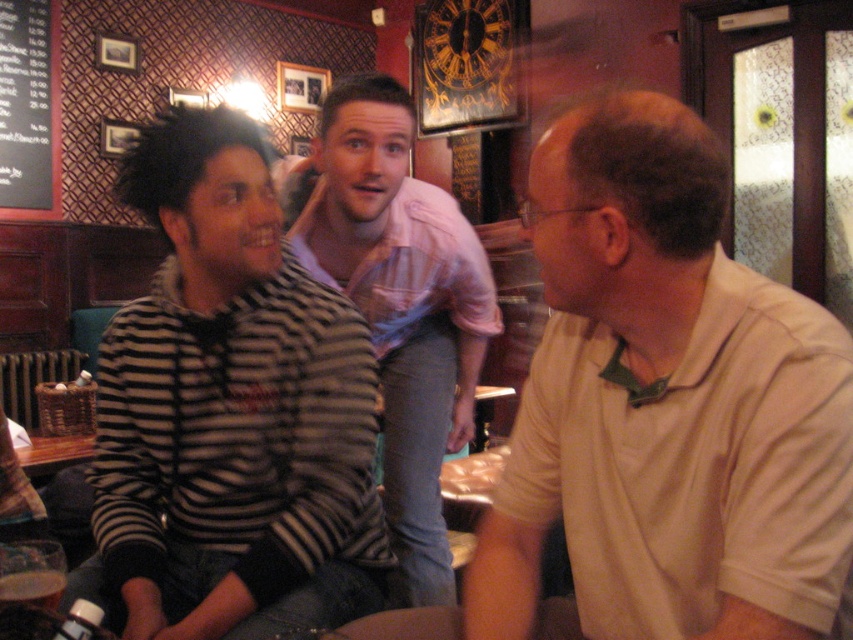
Is point (834, 616) farther from viewer compared to point (238, 122)?

No, it is in front of (238, 122).

Is light beige shirt at center smaller than striped sweater at left?

Incorrect, light beige shirt at center is not smaller in size than striped sweater at left.

Image resolution: width=853 pixels, height=640 pixels. Describe the element at coordinates (659, 412) in the screenshot. I see `light beige shirt at center` at that location.

This screenshot has height=640, width=853. I want to click on light beige shirt at center, so click(x=659, y=412).

Is light beige shirt at center wider than pink cotton shirt at center?

Indeed, light beige shirt at center has a greater width compared to pink cotton shirt at center.

Is light beige shirt at center positioned in front of pink cotton shirt at center?

Yes.

Is point (686, 248) closer to camera compared to point (434, 440)?

Yes, it is.

Locate an element on the screen. Image resolution: width=853 pixels, height=640 pixels. light beige shirt at center is located at coordinates (659, 412).

Looking at this image, how far apart are pink cotton shirt at center and black chalkboard at upper left?

3.01 meters

This screenshot has width=853, height=640. What do you see at coordinates (399, 304) in the screenshot?
I see `pink cotton shirt at center` at bounding box center [399, 304].

Locate an element on the screen. The height and width of the screenshot is (640, 853). pink cotton shirt at center is located at coordinates (399, 304).